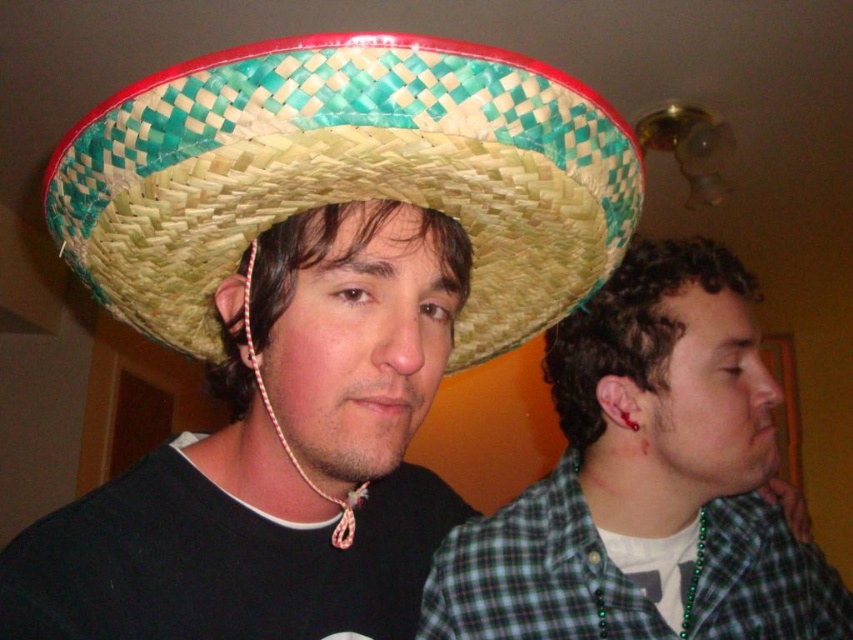
You are a fashion designer observing two people in the image. You need to determine which item is smaller between the woven straw sombrero at center and the green plaid shirt at right. Can you identify which one is smaller?

The woven straw sombrero at center is smaller than the green plaid shirt at right according to the description.

You are a fashion designer observing two people in the image. You need to determine which item is narrower between the woven straw sombrero at center and the green plaid shirt at right. Which one is it?

The woven straw sombrero at center is thinner than the green plaid shirt at right, so the woven straw sombrero at center is narrower.

You are a fashion designer analyzing the image. You need to determine which item is taller between the woven straw sombrero at center and the green plaid shirt at right. Which one is taller?

The woven straw sombrero at center has a lesser height compared to green plaid shirt at right, so the green plaid shirt at right is taller.